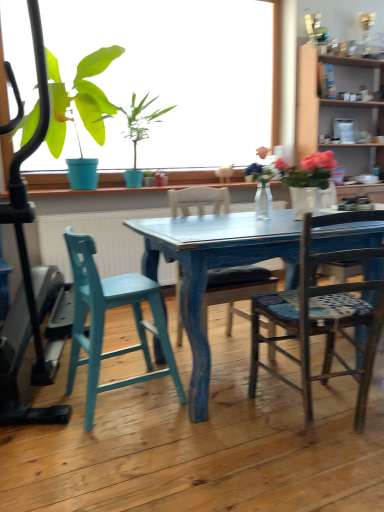
Question: From the image's perspective, is teal wood stool at left, which ranks as the 1th chair in left-to-right order, above green matte plant at upper left?

Choices:
 (A) yes
 (B) no

Answer: (B)

Question: Considering the relative sizes of teal wood stool at left, which ranks as the 1th chair in left-to-right order, and green matte plant at upper left in the image provided, is teal wood stool at left, which ranks as the 1th chair in left-to-right order, wider than green matte plant at upper left?

Choices:
 (A) yes
 (B) no

Answer: (B)

Question: Is teal wood stool at left, which ranks as the 1th chair in left-to-right order, completely or partially outside of green matte plant at upper left?

Choices:
 (A) yes
 (B) no

Answer: (A)

Question: Is teal wood stool at left, which ranks as the 1th chair in left-to-right order, taller than green matte plant at upper left?

Choices:
 (A) no
 (B) yes

Answer: (A)

Question: From the image's perspective, does teal wood stool at left, which appears as the 3th chair when viewed from the right, appear lower than green matte plant at upper left?

Choices:
 (A) no
 (B) yes

Answer: (B)

Question: From a real-world perspective, is teal wood stool at left, which ranks as the 1th chair in left-to-right order, beneath green matte plant at upper left?

Choices:
 (A) yes
 (B) no

Answer: (A)

Question: Does matte white mug at upper center appear on the left side of wooden chair with patterned seat cushion at center, the 1th chair when ordered from right to left?

Choices:
 (A) yes
 (B) no

Answer: (B)

Question: Considering the relative sizes of matte white mug at upper center and wooden chair with patterned seat cushion at center, which appears as the third chair when viewed from the left, in the image provided, is matte white mug at upper center shorter than wooden chair with patterned seat cushion at center, which appears as the third chair when viewed from the left,?

Choices:
 (A) yes
 (B) no

Answer: (A)

Question: Is matte white mug at upper center oriented towards wooden chair with patterned seat cushion at center, the 1th chair when ordered from right to left?

Choices:
 (A) no
 (B) yes

Answer: (A)

Question: Does matte white mug at upper center come in front of wooden chair with patterned seat cushion at center, the 1th chair when ordered from right to left?

Choices:
 (A) no
 (B) yes

Answer: (A)

Question: From the image's perspective, would you say matte white mug at upper center is shown under wooden chair with patterned seat cushion at center, the 1th chair when ordered from right to left?

Choices:
 (A) no
 (B) yes

Answer: (A)

Question: Does matte white mug at upper center have a greater height compared to wooden chair with patterned seat cushion at center, the 1th chair when ordered from right to left?

Choices:
 (A) yes
 (B) no

Answer: (B)

Question: Is the depth of wooden chair at center, which appears as the second chair when viewed from the left, less than that of teal wood stool at left, which ranks as the 1th chair in left-to-right order?

Choices:
 (A) yes
 (B) no

Answer: (B)